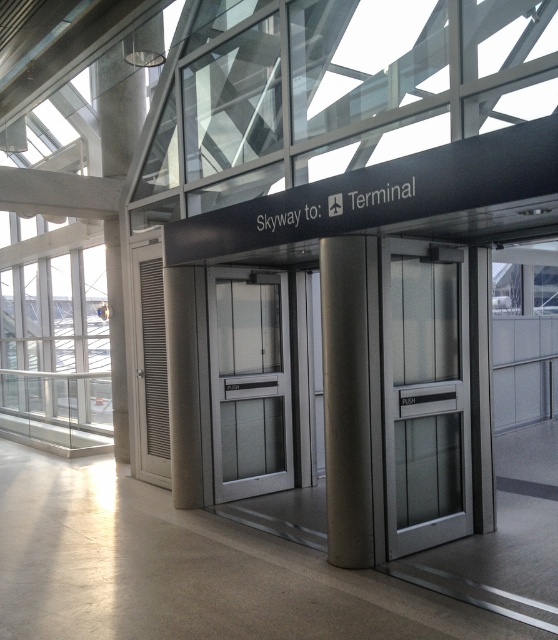
Question: Does frosted glass door at center come in front of satin silver column at center?

Choices:
 (A) no
 (B) yes

Answer: (A)

Question: In this image, where is satin silver elevator at center located relative to frosted glass door at center?

Choices:
 (A) left
 (B) right

Answer: (B)

Question: Which point is farther to the camera?

Choices:
 (A) frosted glass door at center
 (B) satin silver elevator at center
 (C) satin silver column at center

Answer: (A)

Question: Which of the following is the farthest from the observer?

Choices:
 (A) (425, 406)
 (B) (339, 532)

Answer: (A)

Question: From the image, what is the correct spatial relationship of frosted glass door at center in relation to satin silver column at center?

Choices:
 (A) above
 (B) below

Answer: (B)

Question: Which point is farther to the camera?

Choices:
 (A) (291, 416)
 (B) (459, 296)
 (C) (367, 493)

Answer: (A)